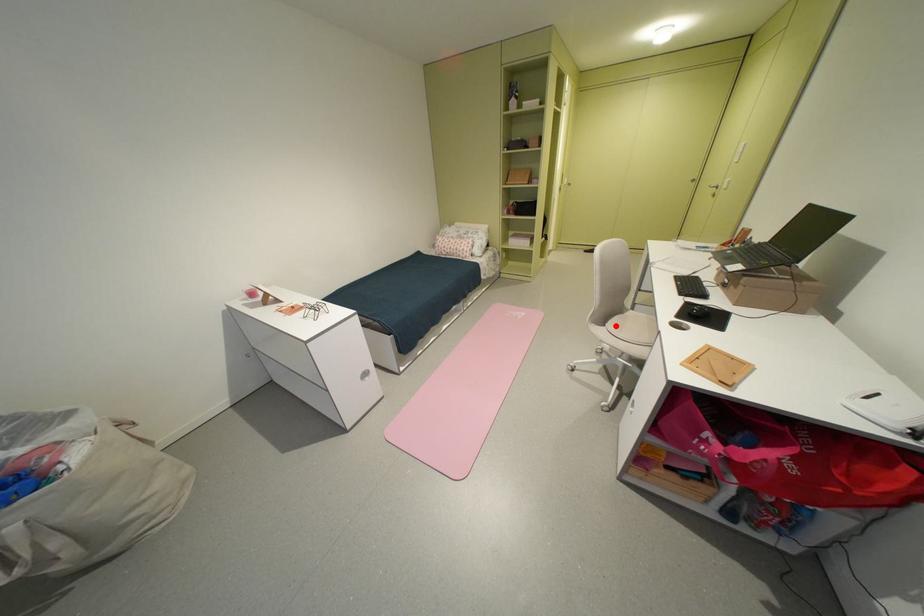
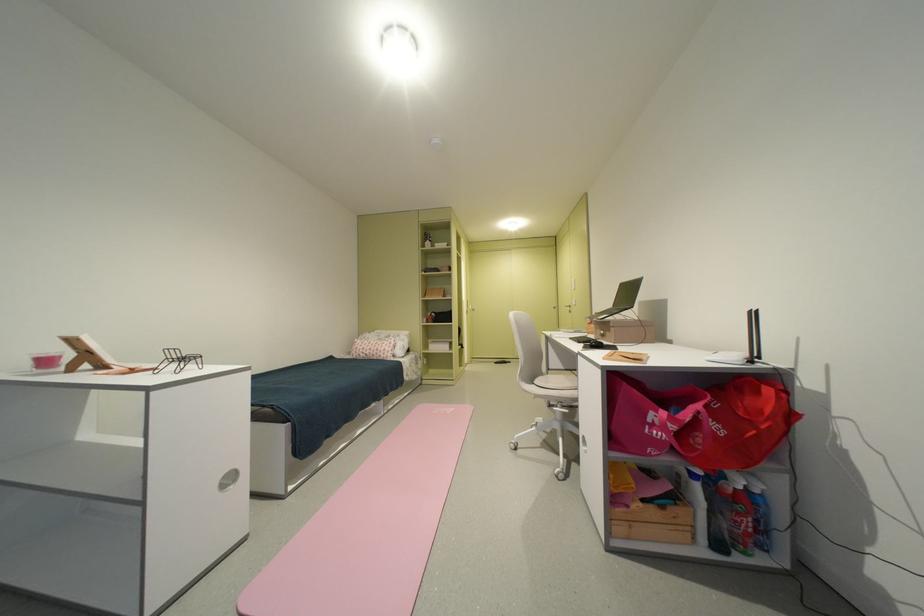
Find the pixel in the second image that matches the highlighted location in the first image.

(543, 383)